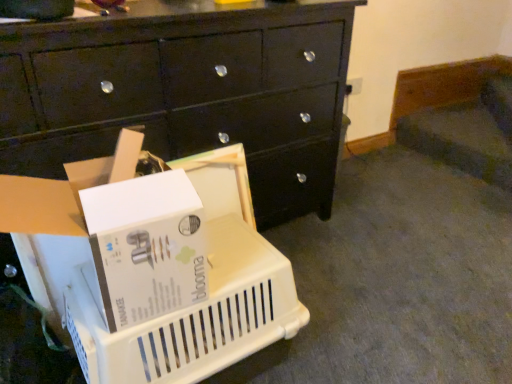
Question: Would you say black glossy chest of drawers at center contains white plastic storage box at lower left?

Choices:
 (A) yes
 (B) no

Answer: (B)

Question: Is black glossy chest of drawers at center at the right side of white plastic storage box at lower left?

Choices:
 (A) no
 (B) yes

Answer: (B)

Question: Considering the relative sizes of black glossy chest of drawers at center and white plastic storage box at lower left in the image provided, is black glossy chest of drawers at center thinner than white plastic storage box at lower left?

Choices:
 (A) yes
 (B) no

Answer: (B)

Question: Is black glossy chest of drawers at center oriented away from white plastic storage box at lower left?

Choices:
 (A) no
 (B) yes

Answer: (A)

Question: From the image's perspective, would you say black glossy chest of drawers at center is shown under white plastic storage box at lower left?

Choices:
 (A) no
 (B) yes

Answer: (A)

Question: Is black glossy chest of drawers at center further to the viewer compared to white plastic storage box at lower left?

Choices:
 (A) no
 (B) yes

Answer: (B)

Question: Is white plastic basket at lower left far from white plastic storage box at lower left?

Choices:
 (A) yes
 (B) no

Answer: (B)

Question: Considering the relative positions of white plastic basket at lower left and white plastic storage box at lower left in the image provided, is white plastic basket at lower left to the left of white plastic storage box at lower left from the viewer's perspective?

Choices:
 (A) yes
 (B) no

Answer: (B)

Question: Would you say white plastic basket at lower left is outside white plastic storage box at lower left?

Choices:
 (A) no
 (B) yes

Answer: (B)

Question: Does white plastic basket at lower left have a greater height compared to white plastic storage box at lower left?

Choices:
 (A) yes
 (B) no

Answer: (A)

Question: Considering the relative sizes of white plastic basket at lower left and white plastic storage box at lower left in the image provided, is white plastic basket at lower left smaller than white plastic storage box at lower left?

Choices:
 (A) yes
 (B) no

Answer: (B)

Question: Is white plastic basket at lower left facing towards white plastic storage box at lower left?

Choices:
 (A) no
 (B) yes

Answer: (A)

Question: Is black glossy chest of drawers at center turned away from white plastic basket at lower left?

Choices:
 (A) no
 (B) yes

Answer: (A)